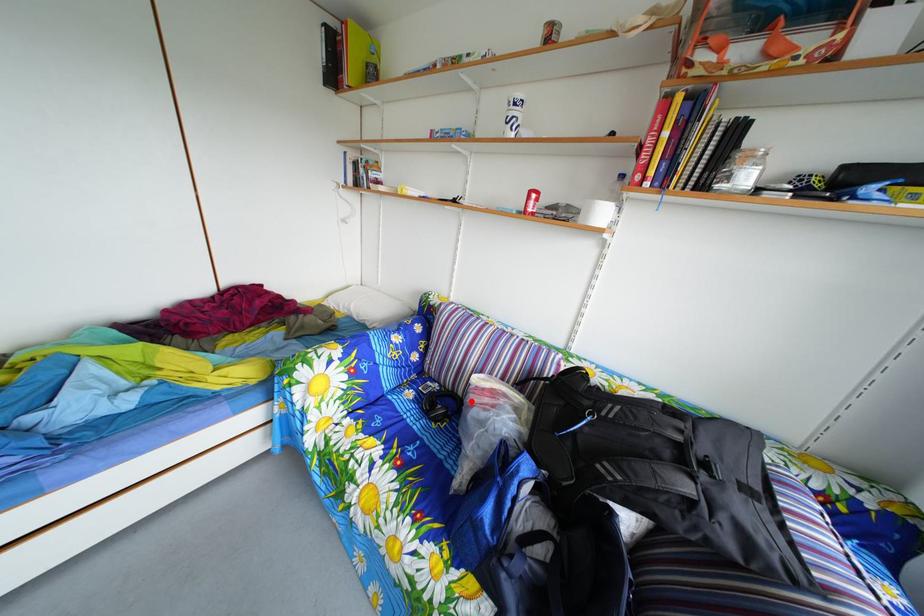
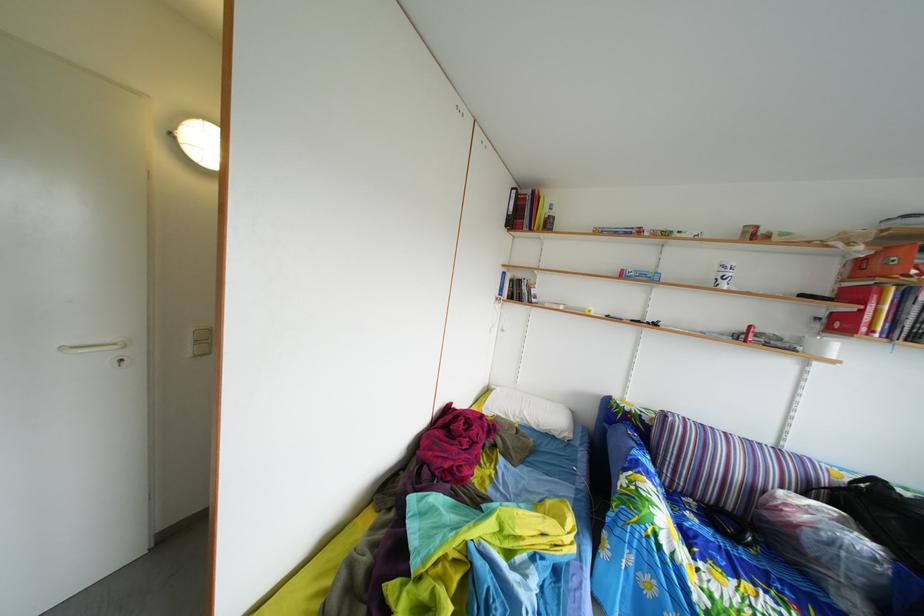
Locate, in the second image, the point that corresponds to the highlighted location in the first image.

(739, 516)